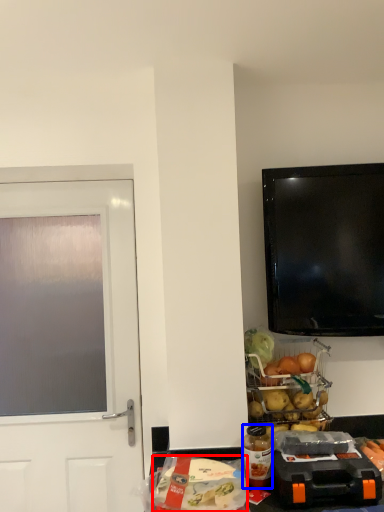
Question: Which object appears closest to the camera in this image, food (highlighted by a red box) or bottle (highlighted by a blue box)?

Choices:
 (A) food
 (B) bottle

Answer: (A)